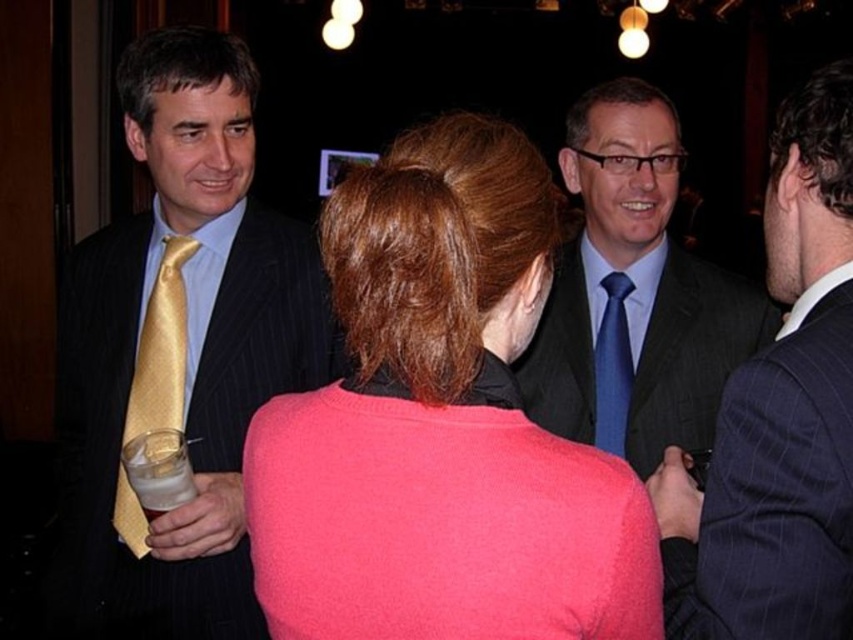
You are a photographer at the event and want to take a photo focusing on the matte gold tie at left and the dark gray pinstripe suit at center. Which object will appear larger in the photo?

The matte gold tie at left will appear larger in the photo because it is closer to the viewer than the dark gray pinstripe suit at center.

You are at the point labeled point (189, 372) and want to move towards the point labeled point (641, 470). Is the path between these two points clear of any obstacles?

The path between point (189, 372) and point (641, 470) is clear of any obstacles as there are no objects mentioned in the scene description that would block the path.

You are a photographer trying to capture a closeup of the pink woolen sweater at center and the dark gray pinstripe suit at center. Based on their sizes, which one would require you to move closer to get a detailed shot?

The pink woolen sweater at center has a smaller size compared to dark gray pinstripe suit at center, so you would need to move closer to the pink woolen sweater at center to capture its details.